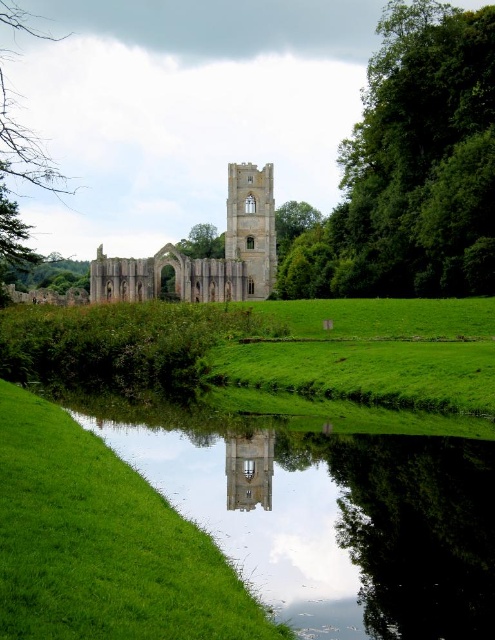
Question: Which point appears closest to the camera in this image?

Choices:
 (A) (200, 243)
 (B) (16, 522)
 (C) (448, 195)
 (D) (288, 612)

Answer: (B)

Question: Is green grassy at lower left to the right of green leafy tree at upper left from the viewer's perspective?

Choices:
 (A) no
 (B) yes

Answer: (B)

Question: Does transparent glass tower at center have a larger size compared to green leafy tree at center?

Choices:
 (A) no
 (B) yes

Answer: (A)

Question: In this image, where is transparent glass water at center located relative to green leafy tree at upper right?

Choices:
 (A) above
 (B) below

Answer: (B)

Question: Which object appears closest to the camera in this image?

Choices:
 (A) brown stone ruins at center
 (B) transparent glass water at center
 (C) transparent glass tower at center

Answer: (B)

Question: Which point is farther to the camera?

Choices:
 (A) green grassy at lower left
 (B) transparent glass tower at center
 (C) green leafy tree at upper right
 (D) green leafy tree at center

Answer: (D)